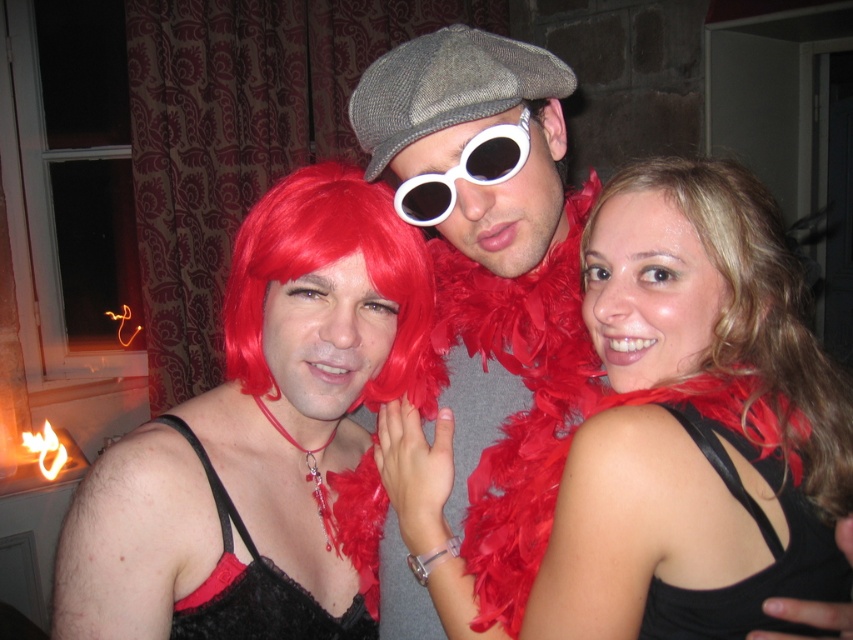
Question: Which point is closer to the camera taking this photo?

Choices:
 (A) (477, 164)
 (B) (416, 385)

Answer: (A)

Question: Can you confirm if shiny red wig at center is bigger than textured gray cap at center?

Choices:
 (A) yes
 (B) no

Answer: (B)

Question: Is smooth black tank top at center below black satin dress at center?

Choices:
 (A) yes
 (B) no

Answer: (B)

Question: Can you confirm if shiny red wig at center is positioned below white matte goggles at center?

Choices:
 (A) no
 (B) yes

Answer: (B)

Question: Which is nearer to the red fluffy wig at center?

Choices:
 (A) black satin dress at right
 (B) shiny red wig at center
 (C) white matte goggles at center

Answer: (B)

Question: Which of the following is the closest to the observer?

Choices:
 (A) black satin dress at right
 (B) black satin dress at center
 (C) textured gray cap at center

Answer: (A)